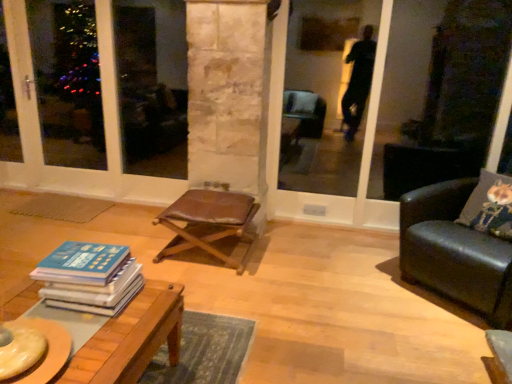
Question: Could you tell me if black leather couch at right is facing leather stool at center?

Choices:
 (A) yes
 (B) no

Answer: (B)

Question: Considering the relative sizes of black leather couch at right and leather stool at center in the image provided, is black leather couch at right wider than leather stool at center?

Choices:
 (A) no
 (B) yes

Answer: (B)

Question: Can you confirm if black leather couch at right is positioned to the left of leather stool at center?

Choices:
 (A) no
 (B) yes

Answer: (A)

Question: Is the depth of black leather couch at right greater than that of leather stool at center?

Choices:
 (A) no
 (B) yes

Answer: (A)

Question: Can you confirm if black leather couch at right is positioned to the right of leather stool at center?

Choices:
 (A) yes
 (B) no

Answer: (A)

Question: Is black leather couch at right completely or partially outside of leather stool at center?

Choices:
 (A) yes
 (B) no

Answer: (A)

Question: From the image's perspective, would you say blue hardcover book at lower left is shown under wooden table at lower left?

Choices:
 (A) no
 (B) yes

Answer: (A)

Question: Considering the relative sizes of blue hardcover book at lower left and wooden table at lower left in the image provided, is blue hardcover book at lower left thinner than wooden table at lower left?

Choices:
 (A) yes
 (B) no

Answer: (A)

Question: Is blue hardcover book at lower left shorter than wooden table at lower left?

Choices:
 (A) no
 (B) yes

Answer: (B)

Question: Is blue hardcover book at lower left positioned far away from wooden table at lower left?

Choices:
 (A) no
 (B) yes

Answer: (A)

Question: Can you confirm if blue hardcover book at lower left is wider than wooden table at lower left?

Choices:
 (A) yes
 (B) no

Answer: (B)

Question: From the image's perspective, is blue hardcover book at lower left located above wooden table at lower left?

Choices:
 (A) no
 (B) yes

Answer: (B)

Question: Is leather stool at center taller than blue hardcover book at lower left?

Choices:
 (A) no
 (B) yes

Answer: (B)